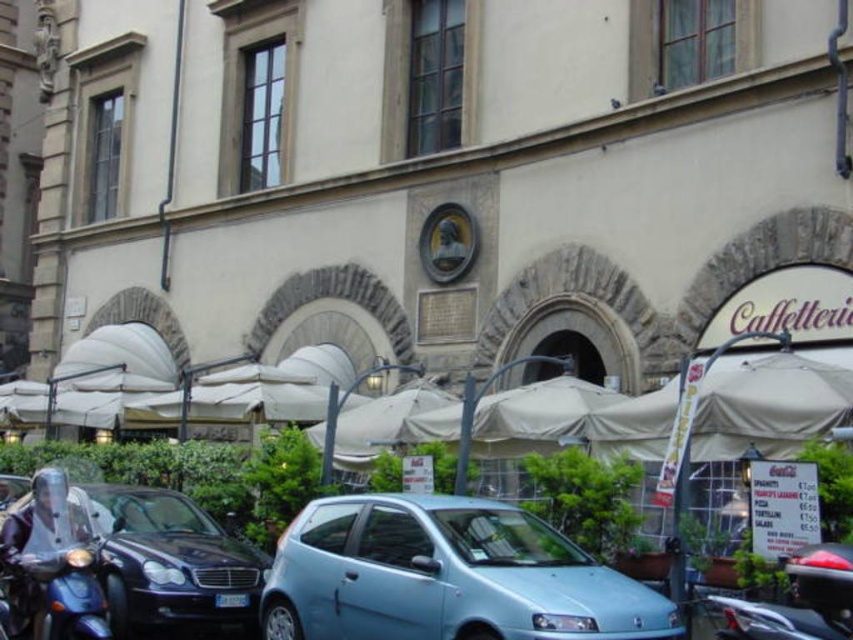
You are a delivery person who needs to park your vehicle in the parking spot behind the light blue metallic hatchback at center and the metallic blue scooter at lower left. The parking spot is exactly 2 meters wide. Can both vehicles fit side by side in the parking spot?

The light blue metallic hatchback at center might be wider than metallic blue scooter at lower left, so it is uncertain if both can fit side by side in the 2 meter wide parking spot. Measure the width of the hatchback first before deciding.

You are standing in front of the European building with the Caffetteria sign and want to take a photo of the building without any vehicles in the frame. Is there a shiny black car at left in the current view?

Yes, there is a shiny black car at left in the current view, located at point (171, 563). To avoid it in the photo, you would need to reposition yourself or zoom in to exclude that area.